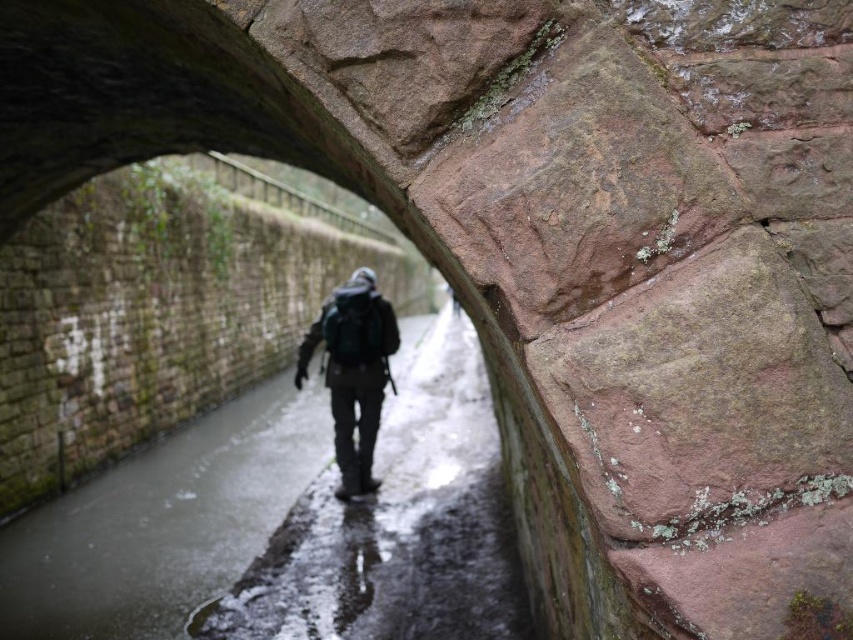
Question: Is wet concrete path at center to the left of dark green backpack at center from the viewer's perspective?

Choices:
 (A) yes
 (B) no

Answer: (B)

Question: Is wet concrete path at center closer to the viewer compared to dark green backpack at center?

Choices:
 (A) yes
 (B) no

Answer: (A)

Question: Can you confirm if wet concrete path at center is positioned to the right of dark green backpack at center?

Choices:
 (A) no
 (B) yes

Answer: (B)

Question: Which of the following is the closest to the observer?

Choices:
 (A) (380, 356)
 (B) (415, 369)

Answer: (A)

Question: Which point is farther to the camera?

Choices:
 (A) dark green backpack at center
 (B) wet concrete path at center

Answer: (A)